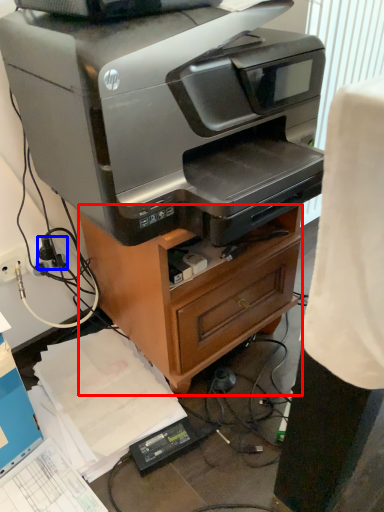
Question: Which of the following is the farthest to the observer, furniture (highlighted by a red box) or plug (highlighted by a blue box)?

Choices:
 (A) furniture
 (B) plug

Answer: (B)